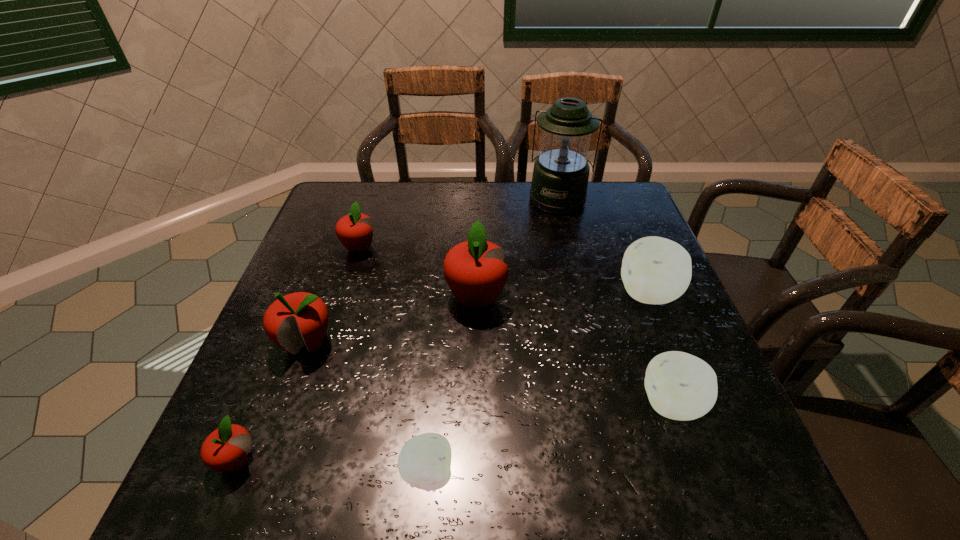
At what (x,y) coordinates should I click in order to perform the action: click on the farthest object. Please return your answer as a coordinate pair (x, y). The image size is (960, 540). Looking at the image, I should click on (560, 177).

Image resolution: width=960 pixels, height=540 pixels. In order to click on lantern in this screenshot , I will do point(560,177).

Find the location of a particular element. Image resolution: width=960 pixels, height=540 pixels. the tallest apple is located at coordinates (475, 271).

Where is `the biggest red apple`? the biggest red apple is located at coordinates (475, 271).

Find the location of a particular element. The image size is (960, 540). the biggest white apple is located at coordinates (655, 270).

The image size is (960, 540). I want to click on the fifth farthest object, so click(299, 319).

Identify the location of the third farthest red apple. (299, 319).

In order to click on the farthest apple in this screenshot , I will do `click(355, 231)`.

You are a GUI agent. You are given a task and a screenshot of the screen. Output one action in this format:
    pyautogui.click(x=<x>, y=<y>)
    Task: Click on the second farthest object
    The image size is (960, 540).
    Given the screenshot: What is the action you would take?
    pyautogui.click(x=355, y=231)

Locate an element on the screen. the sixth farthest object is located at coordinates (680, 386).